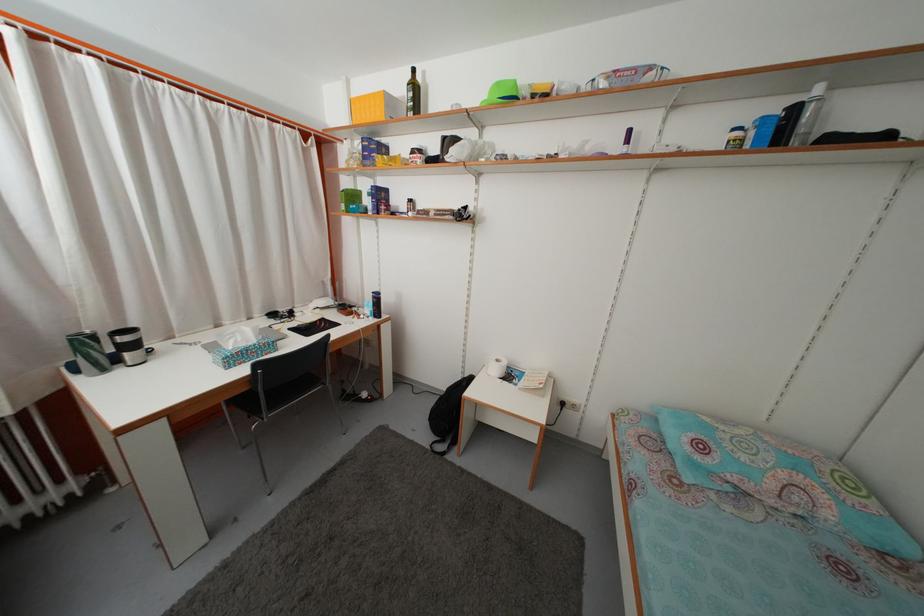
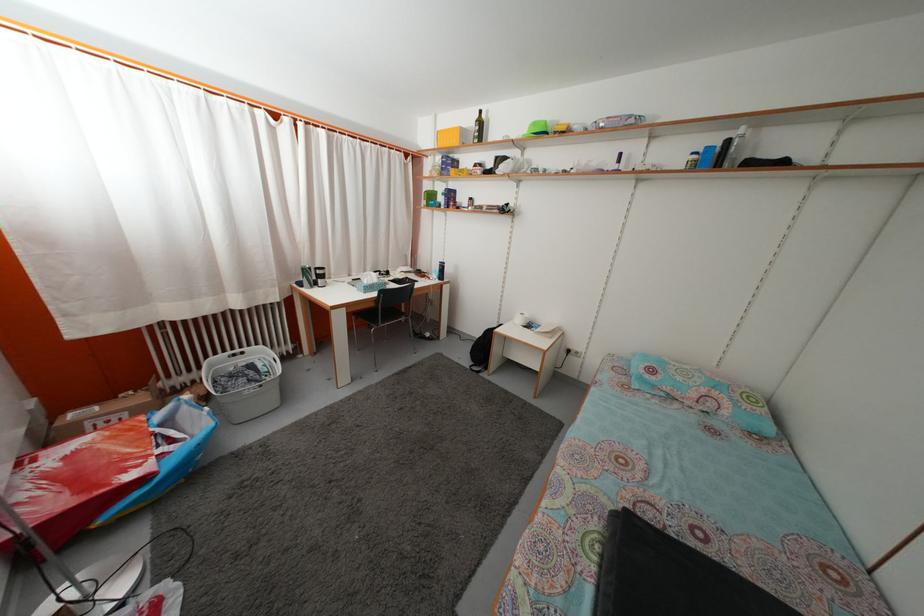
Find the pixel in the second image that matches (x=224, y=333) in the first image.

(355, 283)